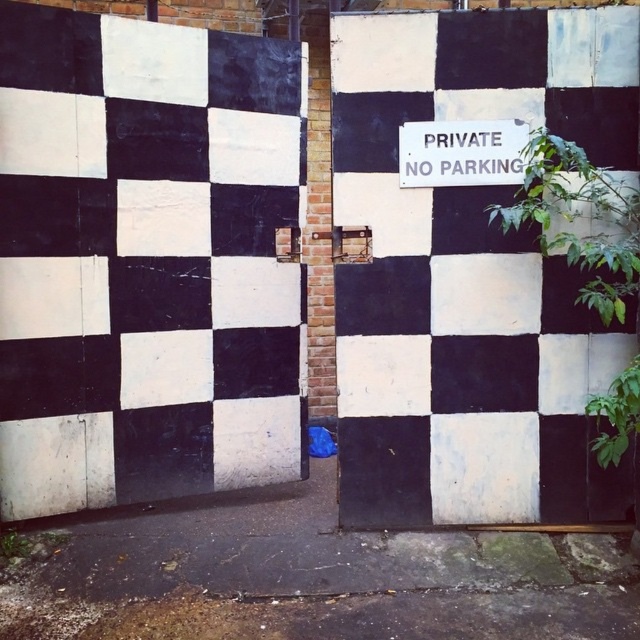
Question: Among these objects, which one is nearest to the camera?

Choices:
 (A) white plastic sign at upper center
 (B) black painted wood door at center

Answer: (B)

Question: Among these points, which one is farthest from the camera?

Choices:
 (A) (422, 125)
 (B) (348, 65)

Answer: (B)

Question: Does black painted wood door at center appear on the right side of white plastic sign at upper center?

Choices:
 (A) yes
 (B) no

Answer: (A)

Question: Which point appears farthest from the camera in this image?

Choices:
 (A) (410, 131)
 (B) (552, 486)

Answer: (B)

Question: Is black painted wood door at center bigger than white plastic sign at upper center?

Choices:
 (A) no
 (B) yes

Answer: (B)

Question: Does black painted wood door at center appear over white plastic sign at upper center?

Choices:
 (A) yes
 (B) no

Answer: (B)